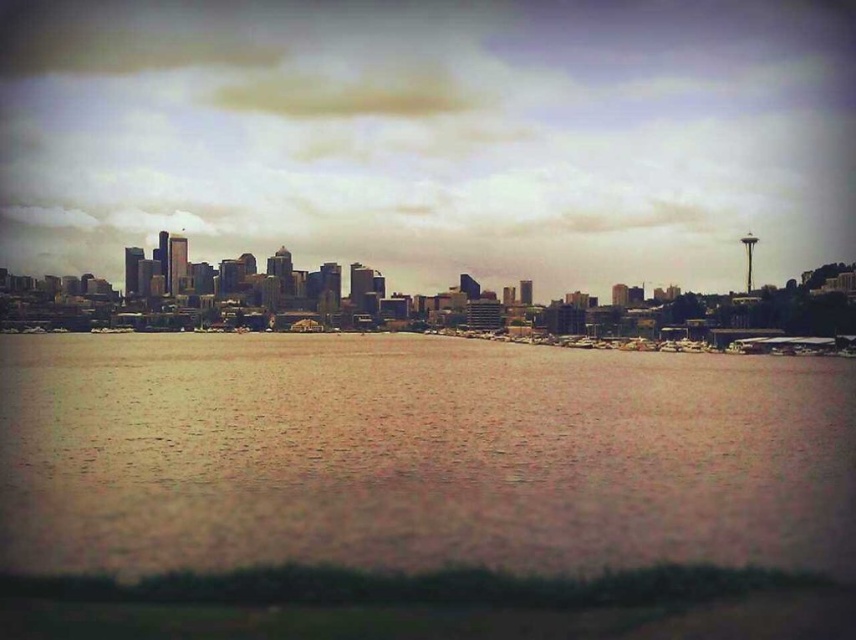
Consider the image. You are standing on a pier and see the brown water at center and the metallic gray boats at center. Which object is positioned to the left?

The brown water at center is positioned to the left of the metallic gray boats at center.

You are a photographer planning to capture the city skyline reflected in the water. You notice the brown water at center and the metallic gray boats at center. Which object should you focus on to ensure the reflection of the city is more prominent?

The brown water at center is larger in size than the metallic gray boats at center, so focusing on the brown water at center will provide a more prominent reflection of the city skyline.

You are a photographer trying to capture the reflection of the metallic gray boats at center in the brown water at center. Based on the scene description, is the water surface flat enough to create a clear reflection?

The brown water at center is positioned under metallic gray boats at center, which suggests that the water surface is calm and flat enough to reflect the boats clearly.